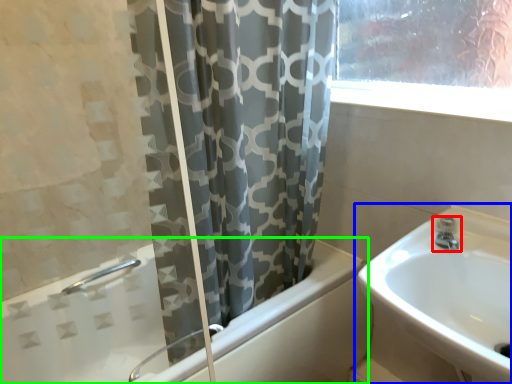
Question: Which object is positioned closest to tap (highlighted by a red box)? Select from sink (highlighted by a blue box) and bathtub (highlighted by a green box).

Choices:
 (A) sink
 (B) bathtub

Answer: (A)